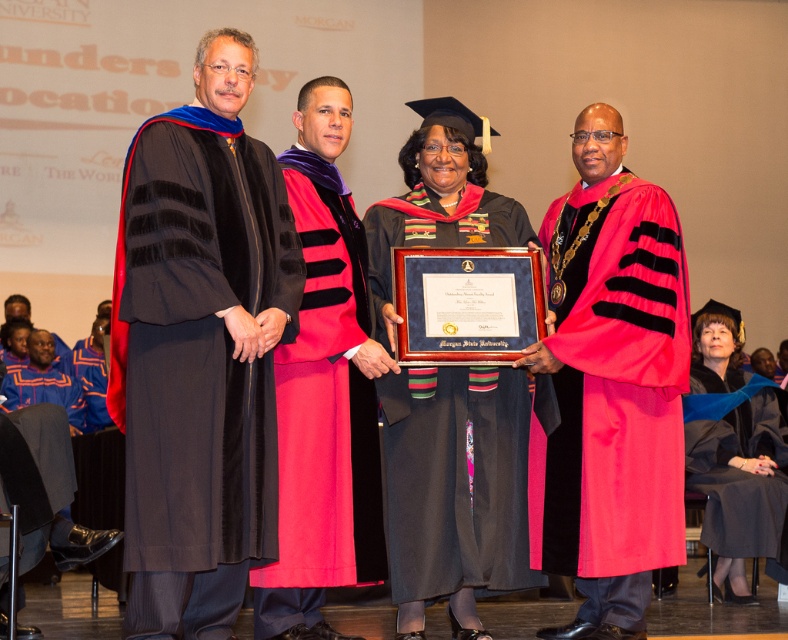
You are a photographer in the audience at the ceremony. You want to capture a photo where both the black velvet gown at center and the red velvet gown at right are visible. Based on their positions, which gown should you focus on first to ensure both are in frame?

The black velvet gown at center is located above the red velvet gown at right, so you should focus on the black velvet gown at center first to ensure both are in frame.

You are a photographer positioned at the back of the auditorium. You want to take a photo of the two points on the stage, which are located at coordinates point (415, 461) and point (723, 477). Which point is closer to the camera?

Point (415, 461) is in front of point (723, 477), so it is closer to the camera.

You are a photographer positioned at the back of the auditorium. You need to capture a photo where both the black velvet gown at center and the red velvet gown at right are clearly visible. Considering their heights, which gown might appear smaller in the photo?

The black velvet gown at center is not as tall as the red velvet gown at right, so it will appear smaller in the photo.